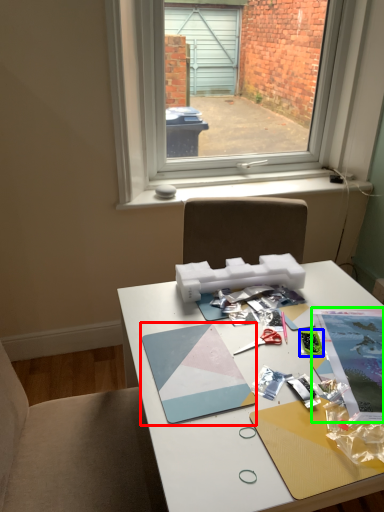
Question: Which object is the farthest from magazine (highlighted by a red box)? Choose among these: stationery (highlighted by a blue box) or magazine (highlighted by a green box).

Choices:
 (A) stationery
 (B) magazine

Answer: (B)